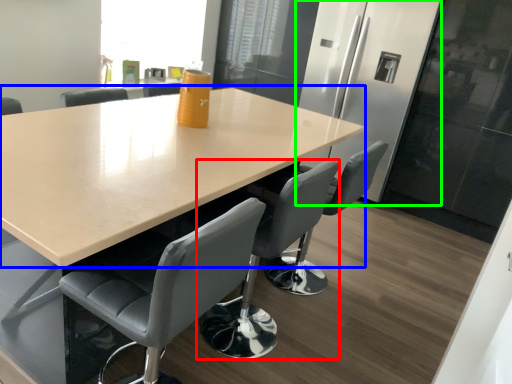
Question: Which object is the farthest from chair (highlighted by a red box)? Choose among these: table (highlighted by a blue box) or fridge (highlighted by a green box).

Choices:
 (A) table
 (B) fridge

Answer: (B)